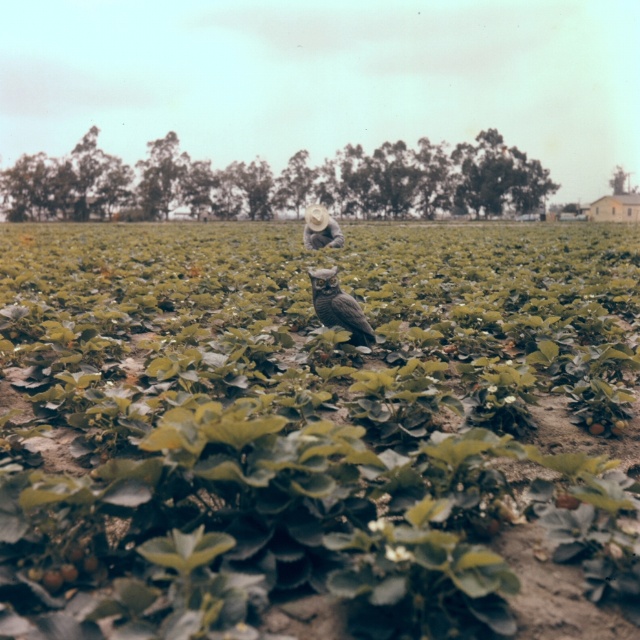
You are a farmer in the strawberry field and you see the green matte plant at center and the brown feathered owl at center. Which one is taller?

The green matte plant at center is much taller than the brown feathered owl at center.

You are a farmer checking the growth of your crops. You notice the green matte plant at center and the light brown straw hat at center. Which object is taller?

The green matte plant at center is taller than the light brown straw hat at center.

You are a photographer standing 1.5 meters tall with a camera in your hands. You want to take a photo of the brown feathered owl at center. If the camera can focus on objects within 5 meters, will you be able to capture the owl clearly?

The brown feathered owl at center and camera are 4.85 meters apart from each other. Since the camera can focus within 5 meters, the distance of 4.85 meters is within the range, so yes, you can capture the owl clearly.